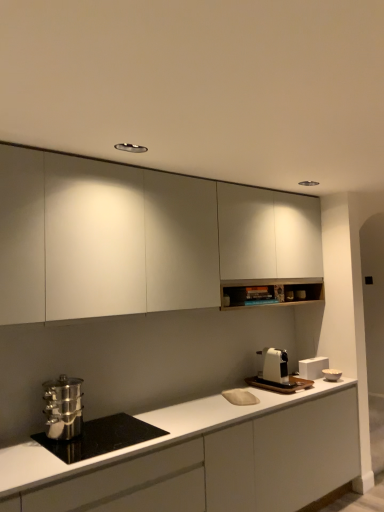
Question: Can you confirm if stainless steel steamer at lower left, acting as the second kitchen appliance starting from the back, is positioned to the left of white matte cabinet at upper center, which is counted as the second cabinetry, starting from the bottom?

Choices:
 (A) no
 (B) yes

Answer: (B)

Question: Is the depth of stainless steel steamer at lower left, the 2th kitchen appliance in the right-to-left sequence, less than that of white matte cabinet at upper center, which is counted as the second cabinetry, starting from the bottom?

Choices:
 (A) yes
 (B) no

Answer: (B)

Question: Does stainless steel steamer at lower left, the 1th kitchen appliance in the left-to-right sequence, appear on the right side of white matte cabinet at upper center, which is counted as the second cabinetry, starting from the bottom?

Choices:
 (A) yes
 (B) no

Answer: (B)

Question: From the image's perspective, is stainless steel steamer at lower left, the 1th kitchen appliance in the left-to-right sequence, located beneath white matte cabinet at upper center, which is counted as the second cabinetry, starting from the bottom?

Choices:
 (A) yes
 (B) no

Answer: (A)

Question: Is stainless steel steamer at lower left, the 1th kitchen appliance in the left-to-right sequence, positioned behind white matte cabinet at upper center, which appears as the 1th cabinetry when viewed from the top?

Choices:
 (A) no
 (B) yes

Answer: (B)

Question: From a real-world perspective, is white matte cabinet at upper center, which appears as the 1th cabinetry when viewed from the top, positioned above or below stainless steel steamer at lower left, the 1th kitchen appliance in the left-to-right sequence?

Choices:
 (A) below
 (B) above

Answer: (B)

Question: From the image's perspective, is white matte cabinet at upper center, which is counted as the second cabinetry, starting from the bottom, above or below stainless steel steamer at lower left, the 2th kitchen appliance in the right-to-left sequence?

Choices:
 (A) below
 (B) above

Answer: (B)

Question: Considering the positions of white matte cabinet at upper center, which appears as the 1th cabinetry when viewed from the top, and stainless steel steamer at lower left, the 2th kitchen appliance in the right-to-left sequence, in the image, is white matte cabinet at upper center, which appears as the 1th cabinetry when viewed from the top, taller or shorter than stainless steel steamer at lower left, the 2th kitchen appliance in the right-to-left sequence,?

Choices:
 (A) short
 (B) tall

Answer: (B)

Question: Is white matte cabinet at upper center, which is counted as the second cabinetry, starting from the bottom, bigger or smaller than stainless steel steamer at lower left, the 1th kitchen appliance in the left-to-right sequence?

Choices:
 (A) big
 (B) small

Answer: (A)

Question: In the image, is white matte countertop at lower left, the 2th cabinetry from the top, positioned in front of or behind stainless steel pot at lower left?

Choices:
 (A) behind
 (B) front

Answer: (B)

Question: From the image's perspective, is white matte countertop at lower left, the 2th cabinetry from the top, located above or below stainless steel pot at lower left?

Choices:
 (A) above
 (B) below

Answer: (B)

Question: From their relative heights in the image, would you say white matte countertop at lower left, which appears as the 1th cabinetry when ordered from the bottom, is taller or shorter than stainless steel pot at lower left?

Choices:
 (A) tall
 (B) short

Answer: (A)

Question: From a real-world perspective, relative to stainless steel pot at lower left, is white matte countertop at lower left, which appears as the 1th cabinetry when ordered from the bottom, vertically above or below?

Choices:
 (A) above
 (B) below

Answer: (B)

Question: In terms of height, does white matte cabinet at upper center, which appears as the 1th cabinetry when viewed from the top, look taller or shorter compared to stainless steel pot at lower left?

Choices:
 (A) short
 (B) tall

Answer: (B)

Question: From a real-world perspective, is white matte cabinet at upper center, which appears as the 1th cabinetry when viewed from the top, physically located above or below stainless steel pot at lower left?

Choices:
 (A) above
 (B) below

Answer: (A)